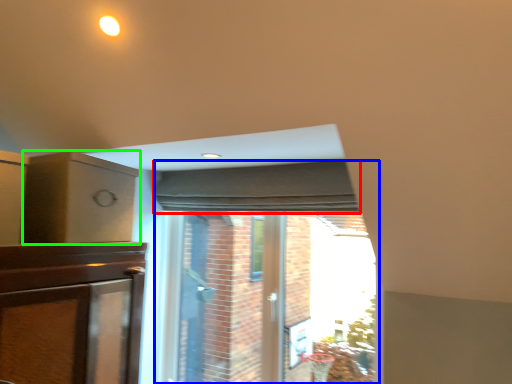
Question: Which object is positioned farthest from curtain (highlighted by a red box)? Select from bay window (highlighted by a blue box) and cabinetry (highlighted by a green box).

Choices:
 (A) bay window
 (B) cabinetry

Answer: (B)